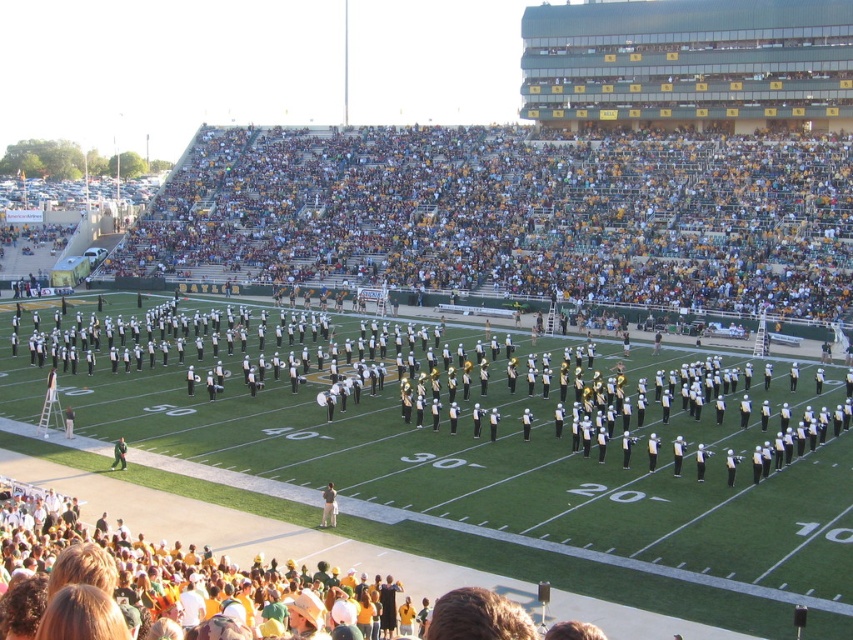
Question: Which point is farther to the camera?

Choices:
 (A) click(x=114, y=451)
 (B) click(x=329, y=486)

Answer: (A)

Question: Can you confirm if white cotton shirt at lower center is positioned above green uniformed person at lower left?

Choices:
 (A) yes
 (B) no

Answer: (B)

Question: Does white cotton shirt at lower center come in front of green uniformed person at lower left?

Choices:
 (A) yes
 (B) no

Answer: (A)

Question: Can you confirm if white cotton shirt at lower center is positioned below green uniformed person at lower left?

Choices:
 (A) yes
 (B) no

Answer: (A)